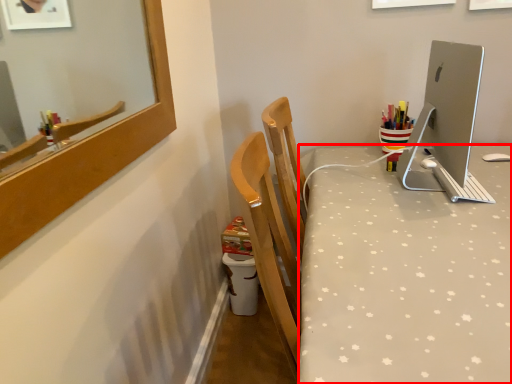
Question: From the image's perspective, what is the correct spatial relationship of desk (annotated by the red box) in relation to desktop computer?

Choices:
 (A) below
 (B) above

Answer: (A)